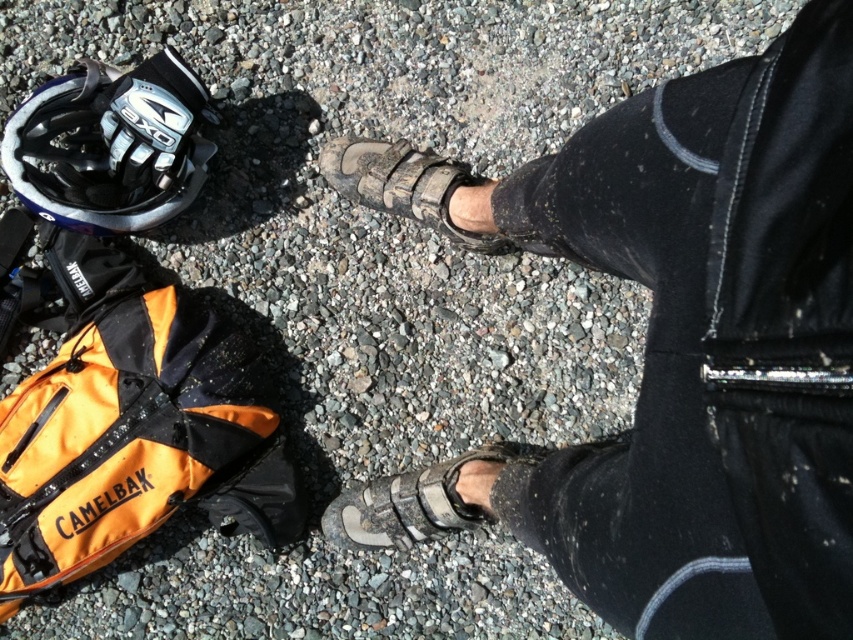
Does gray suede sandal at lower center have a larger size compared to gray suede sandal at center?

Indeed, gray suede sandal at lower center has a larger size compared to gray suede sandal at center.

Between gray suede sandal at lower center and gray suede sandal at center, which one appears on the right side from the viewer's perspective?

gray suede sandal at lower center is more to the right.

Is point (393, 506) more distant than point (345, 189)?

No, it is in front of (345, 189).

Locate an element on the screen. The width and height of the screenshot is (853, 640). gray suede sandal at lower center is located at coordinates (415, 502).

Does leather sandals at center come in front of matte black helmet at upper left?

Yes, leather sandals at center is in front of matte black helmet at upper left.

This screenshot has height=640, width=853. Identify the location of leather sandals at center. (672, 344).

Does point (683, 385) come closer to viewer compared to point (198, 186)?

That is True.

The width and height of the screenshot is (853, 640). Find the location of `leather sandals at center`. leather sandals at center is located at coordinates (672, 344).

The height and width of the screenshot is (640, 853). What do you see at coordinates (672, 344) in the screenshot?
I see `leather sandals at center` at bounding box center [672, 344].

Does leather sandals at center lie in front of black fabric strap at lower right?

Yes, leather sandals at center is closer to the viewer.

Who is more distant from viewer, (837,122) or (677,577)?

The point (677,577) is behind.

At what (x,y) coordinates should I click in order to perform the action: click on leather sandals at center. Please return your answer as a coordinate pair (x, y). The height and width of the screenshot is (640, 853). Looking at the image, I should click on (672, 344).